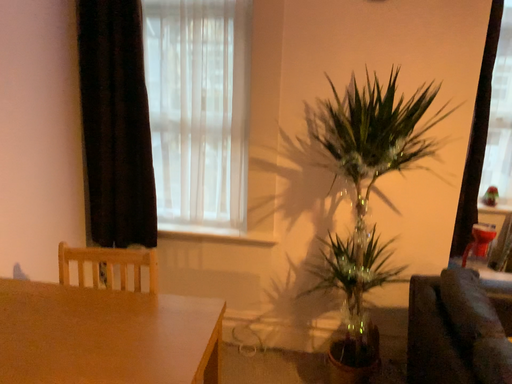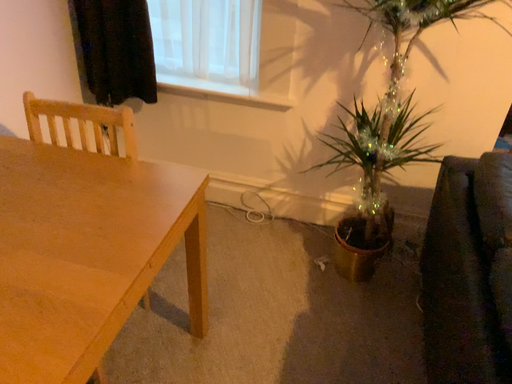
Question: How did the camera likely rotate when shooting the video?

Choices:
 (A) rotated right
 (B) rotated left

Answer: (B)